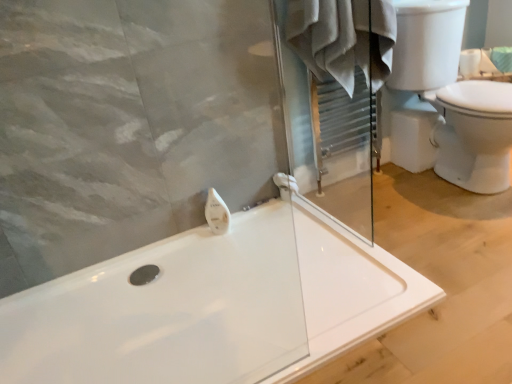
Image resolution: width=512 pixels, height=384 pixels. Describe the element at coordinates (343, 38) in the screenshot. I see `white cotton bathrobe at upper center` at that location.

Image resolution: width=512 pixels, height=384 pixels. I want to click on white glossy toilet at right, so click(453, 96).

The width and height of the screenshot is (512, 384). In order to click on white glossy soap dispenser at upper center in this screenshot , I will do tap(217, 213).

Is point (396, 23) positioned before point (294, 184)?

Yes, it is.

From the image's perspective, which object appears higher, white cotton bathrobe at upper center or white plastic towel bar at center?

From the image's view, white cotton bathrobe at upper center is above.

Could white plastic towel bar at center be considered to be inside white cotton bathrobe at upper center?

No, white plastic towel bar at center is not a part of white cotton bathrobe at upper center.

Consider the image. Is white cotton bathrobe at upper center bigger or smaller than white plastic towel bar at center?

Clearly, white cotton bathrobe at upper center is larger in size than white plastic towel bar at center.

The image size is (512, 384). I want to click on towel bar that is on the left side of white glossy toilet at right, so click(285, 185).

Can you tell me how much white glossy toilet at right and white plastic towel bar at center differ in facing direction?

6.06 degrees separate the facing orientations of white glossy toilet at right and white plastic towel bar at center.

Do you think white glossy toilet at right is within white plastic towel bar at center, or outside of it?

white glossy toilet at right is not enclosed by white plastic towel bar at center.

Considering the relative sizes of white glossy toilet at right and white plastic towel bar at center in the image provided, is white glossy toilet at right wider than white plastic towel bar at center?

Correct, the width of white glossy toilet at right exceeds that of white plastic towel bar at center.

Does white glossy toilet at right have a smaller size compared to white cotton bathrobe at upper center?

No, white glossy toilet at right is not smaller than white cotton bathrobe at upper center.

Is white glossy toilet at right next to white cotton bathrobe at upper center and touching it?

white glossy toilet at right and white cotton bathrobe at upper center are not in contact.

Between white glossy toilet at right and white cotton bathrobe at upper center, which one has larger width?

With larger width is white glossy toilet at right.

Looking at this image, from the image's perspective, between white cotton bathrobe at upper center and white glossy soap dispenser at upper center, who is located below?

white glossy soap dispenser at upper center appears lower in the image.

Which is more to the left, white cotton bathrobe at upper center or white glossy soap dispenser at upper center?

Positioned to the left is white glossy soap dispenser at upper center.

Would you consider white cotton bathrobe at upper center to be distant from white glossy soap dispenser at upper center?

No, white cotton bathrobe at upper center is not far away from white glossy soap dispenser at upper center.

From a real-world perspective, is white cotton bathrobe at upper center under white glossy soap dispenser at upper center?

Actually, white cotton bathrobe at upper center is physically above white glossy soap dispenser at upper center in the real world.

Is white cotton bathrobe at upper center at the left side of white glossy bathtub at center?

No, white cotton bathrobe at upper center is not to the left of white glossy bathtub at center.

Is white cotton bathrobe at upper center closer to the viewer compared to white glossy bathtub at center?

No, white cotton bathrobe at upper center is further to the viewer.

Considering the sizes of objects white cotton bathrobe at upper center and white glossy bathtub at center in the image provided, who is wider, white cotton bathrobe at upper center or white glossy bathtub at center?

white glossy bathtub at center is wider.

Does white cotton bathrobe at upper center have a greater height compared to white glossy bathtub at center?

Correct, white cotton bathrobe at upper center is much taller as white glossy bathtub at center.

Is white glossy toilet at right looking in the opposite direction of white glossy bathtub at center?

No, white glossy toilet at right is not facing the opposite direction of white glossy bathtub at center.

Is white glossy toilet at right touching white glossy bathtub at center?

No, white glossy toilet at right is not beside white glossy bathtub at center.

From a real-world perspective, who is located higher, white glossy toilet at right or white glossy bathtub at center?

white glossy toilet at right is physically above.

Between white plastic towel bar at center and white glossy bathtub at center, which one appears on the right side from the viewer's perspective?

Positioned to the right is white glossy bathtub at center.

Are white plastic towel bar at center and white glossy bathtub at center far apart?

No, there isn't a large distance between white plastic towel bar at center and white glossy bathtub at center.

From the image's perspective, between white plastic towel bar at center and white glossy bathtub at center, who is located below?

white glossy bathtub at center appears lower in the image.

Does white plastic towel bar at center have a lesser width compared to white glossy bathtub at center?

Yes.

Find the location of `towel bar located underneath the white cotton bathrobe at upper center (from a real-world perspective)`. towel bar located underneath the white cotton bathrobe at upper center (from a real-world perspective) is located at coordinates (285, 185).

This screenshot has width=512, height=384. Find the location of `towel bar lying behind the white glossy toilet at right`. towel bar lying behind the white glossy toilet at right is located at coordinates (285, 185).

From the image, which object appears to be farther from white glossy bathtub at center, white glossy soap dispenser at upper center or white plastic towel bar at center?

Among the two, white plastic towel bar at center is located further to white glossy bathtub at center.

Considering their positions, is white glossy bathtub at center positioned closer to white glossy toilet at right than white plastic towel bar at center?

white plastic towel bar at center lies closer to white glossy toilet at right than the other object.

Considering their positions, is white plastic towel bar at center positioned further to white glossy toilet at right than white glossy bathtub at center?

white glossy bathtub at center is positioned further to the anchor white glossy toilet at right.

Considering their positions, is white glossy soap dispenser at upper center positioned closer to white cotton bathrobe at upper center than white glossy toilet at right?

white glossy toilet at right lies closer to white cotton bathrobe at upper center than the other object.

Based on their spatial positions, is white plastic towel bar at center or white glossy toilet at right further from white glossy bathtub at center?

Among the two, white glossy toilet at right is located further to white glossy bathtub at center.

Looking at the image, which one is located further to white glossy toilet at right, white plastic towel bar at center or white glossy soap dispenser at upper center?

white glossy soap dispenser at upper center is further to white glossy toilet at right.

Considering their positions, is white plastic towel bar at center positioned further to white glossy bathtub at center than white glossy soap dispenser at upper center?

white plastic towel bar at center lies further to white glossy bathtub at center than the other object.

Looking at the image, which one is located closer to white glossy soap dispenser at upper center, white plastic towel bar at center or white glossy bathtub at center?

The object closer to white glossy soap dispenser at upper center is white plastic towel bar at center.

Where is `sink between white cotton bathrobe at upper center and white glossy bathtub at center vertically`? sink between white cotton bathrobe at upper center and white glossy bathtub at center vertically is located at coordinates (453, 96).

Where is `toiletry located between white glossy bathtub at center and white plastic towel bar at center in the depth direction`? Image resolution: width=512 pixels, height=384 pixels. toiletry located between white glossy bathtub at center and white plastic towel bar at center in the depth direction is located at coordinates (217, 213).

Find the location of a particular element. The height and width of the screenshot is (384, 512). sink between white glossy bathtub at center and white plastic towel bar at center in the front-back direction is located at coordinates (453, 96).

The width and height of the screenshot is (512, 384). Identify the location of bathrobe located between white glossy soap dispenser at upper center and white glossy toilet at right in the left-right direction. (343, 38).